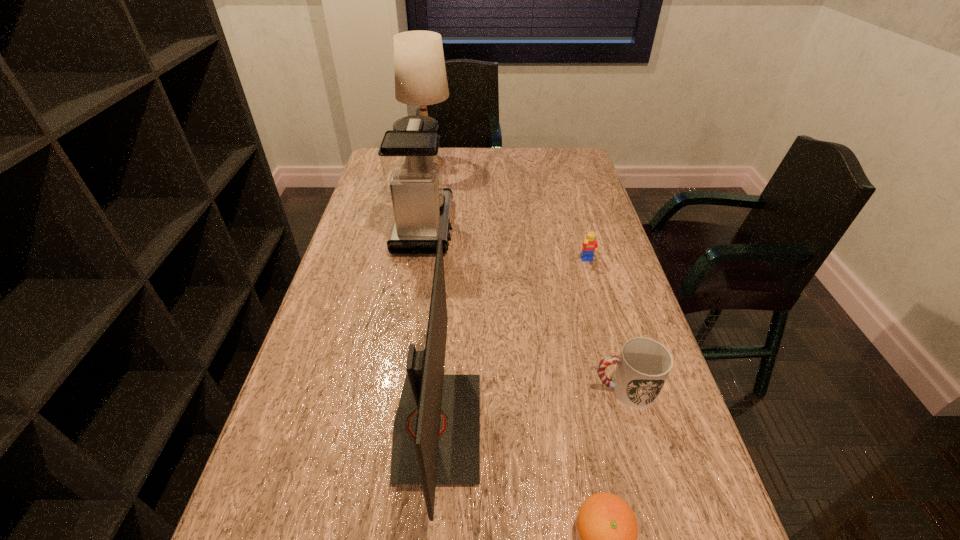
Identify the location of free space at the far right corner. (572, 156).

This screenshot has width=960, height=540. What are the coordinates of `vacant area that lies between the fourth tallest object and the Lego` in the screenshot? It's located at (606, 325).

At what (x,y) coordinates should I click in order to perform the action: click on the third closest object to the orange. Please return your answer as a coordinate pair (x, y). This screenshot has width=960, height=540. Looking at the image, I should click on (589, 246).

Locate which object is the third closest to the lamp. Please provide its 2D coordinates. Your answer should be formatted as a tuple, i.e. [(x, y)], where the tuple contains the x and y coordinates of a point satisfying the conditions above.

[(436, 437)]

This screenshot has height=540, width=960. I want to click on vacant position in the image that satisfies the following two spatial constraints: 1. on the handle side of the fourth tallest object; 2. on the front side of the farthest object, so click(561, 163).

The width and height of the screenshot is (960, 540). Identify the location of vacant space that satisfies the following two spatial constraints: 1. on the handle side of the third shortest object; 2. at the front of the coffee maker where the controls are located. (578, 227).

The image size is (960, 540). I want to click on vacant space that satisfies the following two spatial constraints: 1. on the handle side of the cup; 2. at the front of the coffee maker where the controls are located, so click(x=578, y=227).